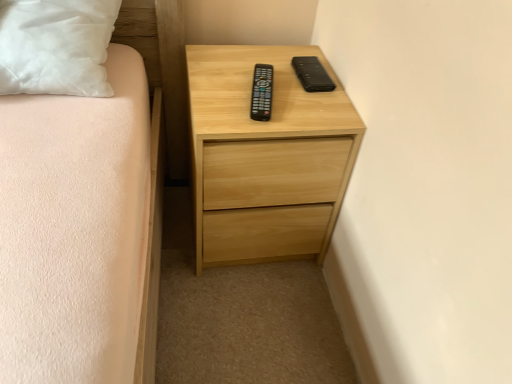
Question: Can we say black plastic remote at center lies outside black matte case at upper right?

Choices:
 (A) no
 (B) yes

Answer: (B)

Question: Does black plastic remote at center have a lesser height compared to black matte case at upper right?

Choices:
 (A) no
 (B) yes

Answer: (A)

Question: Is black plastic remote at center to the right of black matte case at upper right from the viewer's perspective?

Choices:
 (A) no
 (B) yes

Answer: (A)

Question: From the image's perspective, is black plastic remote at center beneath black matte case at upper right?

Choices:
 (A) yes
 (B) no

Answer: (A)

Question: Are black plastic remote at center and black matte case at upper right far apart?

Choices:
 (A) yes
 (B) no

Answer: (B)

Question: Does black plastic remote at center touch black matte case at upper right?

Choices:
 (A) yes
 (B) no

Answer: (B)

Question: Is black plastic remote at center positioned far away from natural wood chest of drawers at center?

Choices:
 (A) yes
 (B) no

Answer: (B)

Question: Considering the relative positions of black plastic remote at center and natural wood chest of drawers at center in the image provided, is black plastic remote at center to the right of natural wood chest of drawers at center from the viewer's perspective?

Choices:
 (A) no
 (B) yes

Answer: (B)

Question: Is black plastic remote at center outside natural wood chest of drawers at center?

Choices:
 (A) no
 (B) yes

Answer: (A)

Question: Is black plastic remote at center further to camera compared to natural wood chest of drawers at center?

Choices:
 (A) yes
 (B) no

Answer: (A)

Question: Does black plastic remote at center have a lesser width compared to natural wood chest of drawers at center?

Choices:
 (A) no
 (B) yes

Answer: (B)

Question: From a real-world perspective, is black plastic remote at center located beneath natural wood chest of drawers at center?

Choices:
 (A) no
 (B) yes

Answer: (A)

Question: Does black matte case at upper right have a lesser height compared to natural wood chest of drawers at center?

Choices:
 (A) yes
 (B) no

Answer: (A)